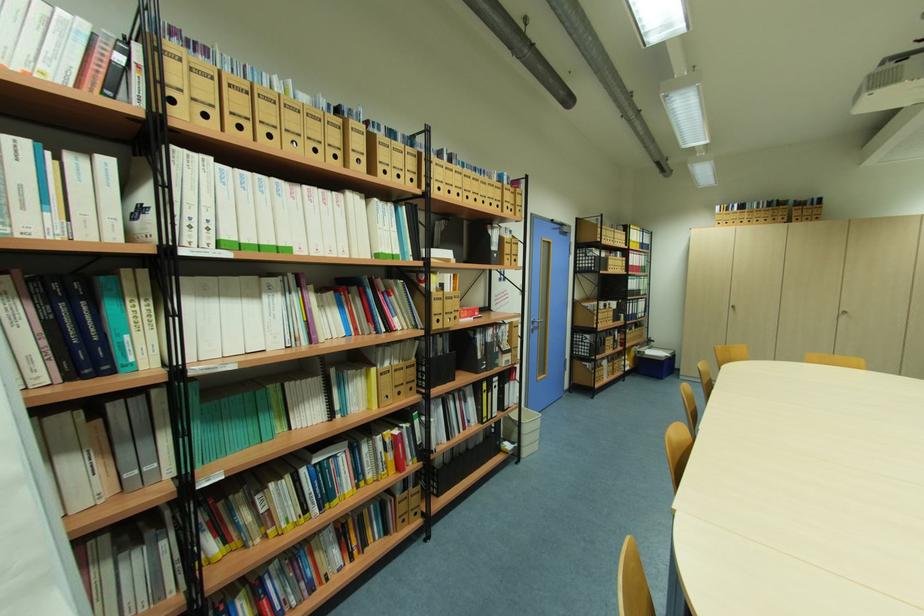
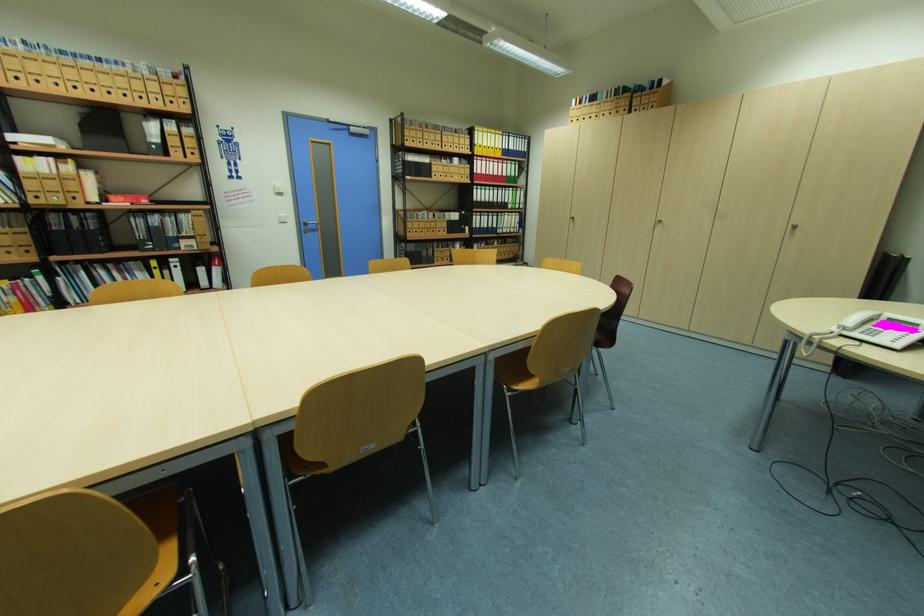
Question: Which direction would the cameraman need to move to produce the second image? Reply with the corresponding letter.

Choices:
 (A) Left
 (B) Right
 (C) Forward
 (D) Backward

Answer: (B)